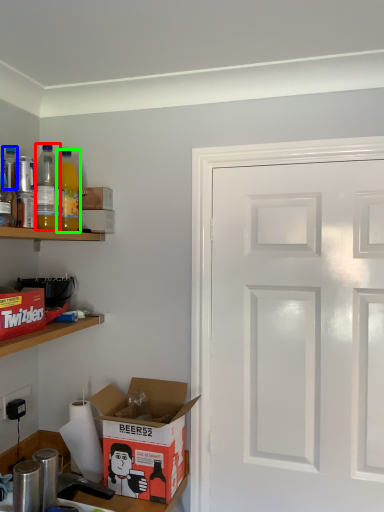
Question: Considering the real-world distances, which object is closest to bottle (highlighted by a red box)? bottle (highlighted by a blue box) or bottle (highlighted by a green box).

Choices:
 (A) bottle
 (B) bottle

Answer: (B)